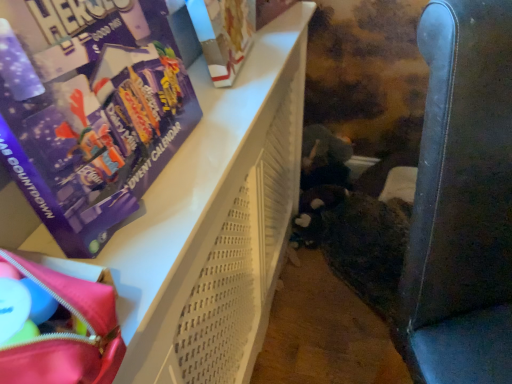
Measure the distance between point (452, 180) and camera.

The distance of point (452, 180) from camera is 27.56 inches.

What is the approximate width of purple cardboard advent calendar at upper left?

The width of purple cardboard advent calendar at upper left is 20.31 centimeters.

Find the location of a particular element. matte pink fabric bag at lower left is located at coordinates (67, 334).

The width and height of the screenshot is (512, 384). What do you see at coordinates (67, 334) in the screenshot?
I see `matte pink fabric bag at lower left` at bounding box center [67, 334].

The height and width of the screenshot is (384, 512). What are the coordinates of `white perforated plastic basket at upper left` in the screenshot? It's located at (216, 222).

Does point (209, 4) lie behind point (117, 7)?

Yes.

Can you tell me how much white cardboard book at upper center and purple cardboard advent calendar at upper left differ in facing direction?

0.00189 degrees.

Looking at their sizes, would you say white cardboard book at upper center is wider or thinner than purple cardboard advent calendar at upper left?

Considering their sizes, white cardboard book at upper center looks slimmer than purple cardboard advent calendar at upper left.

Is white cardboard book at upper center surrounding purple cardboard advent calendar at upper left?

That's incorrect, purple cardboard advent calendar at upper left is not inside white cardboard book at upper center.

Is white cardboard book at upper center situated inside white perforated plastic basket at upper left or outside?

white cardboard book at upper center is not enclosed by white perforated plastic basket at upper left.

Between white cardboard book at upper center and white perforated plastic basket at upper left, which one has more height?

white perforated plastic basket at upper left.

Looking at this image, from a real-world perspective, who is located lower, white cardboard book at upper center or white perforated plastic basket at upper left?

From a 3D spatial view, white perforated plastic basket at upper left is below.

Is white cardboard book at upper center turned away from matte pink fabric bag at lower left?

No, white cardboard book at upper center is not facing away from matte pink fabric bag at lower left.

Considering the relative positions of white cardboard book at upper center and matte pink fabric bag at lower left in the image provided, is white cardboard book at upper center to the right of matte pink fabric bag at lower left from the viewer's perspective?

Yes.

From the image's perspective, is white cardboard book at upper center positioned above or below matte pink fabric bag at lower left?

white cardboard book at upper center is above matte pink fabric bag at lower left.

Which is correct: white cardboard book at upper center is inside matte pink fabric bag at lower left, or outside of it?

white cardboard book at upper center is located beyond the bounds of matte pink fabric bag at lower left.

Does purple cardboard advent calendar at upper left appear on the right side of matte pink fabric bag at lower left?

Yes, purple cardboard advent calendar at upper left is to the right of matte pink fabric bag at lower left.

Is purple cardboard advent calendar at upper left taller or shorter than matte pink fabric bag at lower left?

Clearly, purple cardboard advent calendar at upper left is taller compared to matte pink fabric bag at lower left.

Is purple cardboard advent calendar at upper left not close to matte pink fabric bag at lower left?

Actually, purple cardboard advent calendar at upper left and matte pink fabric bag at lower left are a little close together.

From the image's perspective, would you say purple cardboard advent calendar at upper left is shown under matte pink fabric bag at lower left?

No, from the image's perspective, purple cardboard advent calendar at upper left is not beneath matte pink fabric bag at lower left.

Which is behind, leather-like dark blue armchair at right or matte pink fabric bag at lower left?

Positioned behind is leather-like dark blue armchair at right.

Is leather-like dark blue armchair at right to the right of matte pink fabric bag at lower left from the viewer's perspective?

Yes.

From a real-world perspective, which is physically below, leather-like dark blue armchair at right or matte pink fabric bag at lower left?

leather-like dark blue armchair at right, from a real-world perspective.

Does leather-like dark blue armchair at right have a larger size compared to matte pink fabric bag at lower left?

Correct, leather-like dark blue armchair at right is larger in size than matte pink fabric bag at lower left.

Is white perforated plastic basket at upper left at the back of purple cardboard advent calendar at upper left?

No, white perforated plastic basket at upper left is not at the back of purple cardboard advent calendar at upper left.

Is there a large distance between purple cardboard advent calendar at upper left and white perforated plastic basket at upper left?

No, purple cardboard advent calendar at upper left is in close proximity to white perforated plastic basket at upper left.

Is purple cardboard advent calendar at upper left smaller than white perforated plastic basket at upper left?

Correct, purple cardboard advent calendar at upper left occupies less space than white perforated plastic basket at upper left.

Is purple cardboard advent calendar at upper left to the left or to the right of white perforated plastic basket at upper left in the image?

purple cardboard advent calendar at upper left is positioned on white perforated plastic basket at upper left's left side.

Which of these two, white perforated plastic basket at upper left or purple cardboard advent calendar at upper left, stands taller?

white perforated plastic basket at upper left is taller.

In the scene shown: From a real-world perspective, which object stands above the other?

purple cardboard advent calendar at upper left, from a real-world perspective.

Is white perforated plastic basket at upper left facing towards purple cardboard advent calendar at upper left?

No, white perforated plastic basket at upper left is not aimed at purple cardboard advent calendar at upper left.

This screenshot has width=512, height=384. Find the location of `book that appears above the white cardboard book at upper center (from a real-world perspective)`. book that appears above the white cardboard book at upper center (from a real-world perspective) is located at coordinates (91, 111).

The image size is (512, 384). Find the location of `furniture on the right side of white cardboard book at upper center`. furniture on the right side of white cardboard book at upper center is located at coordinates (216, 222).

When comparing their distances from matte pink fabric bag at lower left, does white perforated plastic basket at upper left or purple cardboard advent calendar at upper left seem closer?

Based on the image, purple cardboard advent calendar at upper left appears to be nearer to matte pink fabric bag at lower left.

Estimate the real-world distances between objects in this image. Which object is further from white cardboard book at upper center, purple cardboard advent calendar at upper left or white perforated plastic basket at upper left?

The object further to white cardboard book at upper center is purple cardboard advent calendar at upper left.

From the image, which object appears to be nearer to leather-like dark blue armchair at right, white cardboard book at upper center or purple cardboard advent calendar at upper left?

Among the two, purple cardboard advent calendar at upper left is located nearer to leather-like dark blue armchair at right.

From the image, which object appears to be farther from purple cardboard advent calendar at upper left, white cardboard book at upper center or leather-like dark blue armchair at right?

Among the two, leather-like dark blue armchair at right is located further to purple cardboard advent calendar at upper left.

Based on their spatial positions, is white cardboard book at upper center or white perforated plastic basket at upper left closer to leather-like dark blue armchair at right?

The object closer to leather-like dark blue armchair at right is white perforated plastic basket at upper left.

Based on their spatial positions, is purple cardboard advent calendar at upper left or white perforated plastic basket at upper left further from leather-like dark blue armchair at right?

purple cardboard advent calendar at upper left lies further to leather-like dark blue armchair at right than the other object.

Which object lies nearer to the anchor point white perforated plastic basket at upper left, leather-like dark blue armchair at right or purple cardboard advent calendar at upper left?

purple cardboard advent calendar at upper left lies closer to white perforated plastic basket at upper left than the other object.

From the image, which object appears to be nearer to white cardboard book at upper center, white perforated plastic basket at upper left or leather-like dark blue armchair at right?

white perforated plastic basket at upper left.

Where is `furniture located between matte pink fabric bag at lower left and leather-like dark blue armchair at right in the left-right direction`? furniture located between matte pink fabric bag at lower left and leather-like dark blue armchair at right in the left-right direction is located at coordinates (216, 222).

I want to click on book between white cardboard book at upper center and white perforated plastic basket at upper left in the vertical direction, so click(x=91, y=111).

Where is `paperback book located between matte pink fabric bag at lower left and leather-like dark blue armchair at right in the left-right direction`? Image resolution: width=512 pixels, height=384 pixels. paperback book located between matte pink fabric bag at lower left and leather-like dark blue armchair at right in the left-right direction is located at coordinates (224, 35).

Where is `book between matte pink fabric bag at lower left and leather-like dark blue armchair at right in the horizontal direction`? This screenshot has width=512, height=384. book between matte pink fabric bag at lower left and leather-like dark blue armchair at right in the horizontal direction is located at coordinates (91, 111).